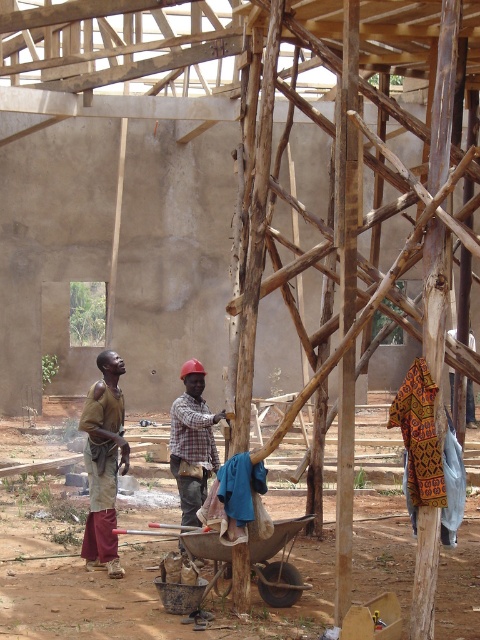
Question: Is brown fabric at left above plaid fabric shirt at center?

Choices:
 (A) yes
 (B) no

Answer: (B)

Question: Which of the following is the farthest from the observer?

Choices:
 (A) plaid fabric shirt at center
 (B) brown fabric at left

Answer: (A)

Question: Considering the relative positions of brown fabric at left and plaid fabric shirt at center in the image provided, where is brown fabric at left located with respect to plaid fabric shirt at center?

Choices:
 (A) left
 (B) right

Answer: (A)

Question: Which point is closer to the camera?

Choices:
 (A) plaid fabric shirt at center
 (B) brown fabric at left

Answer: (B)

Question: Which of the following is the closest to the observer?

Choices:
 (A) plaid fabric shirt at center
 (B) brown fabric at left

Answer: (B)

Question: Can you confirm if brown fabric at left is positioned to the right of plaid fabric shirt at center?

Choices:
 (A) no
 (B) yes

Answer: (A)